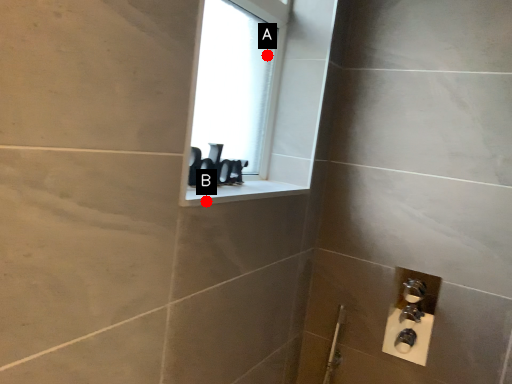
Question: Two points are circled on the image, labeled by A and B beside each circle. Which of the following is the closest to the observer?

Choices:
 (A) A is closer
 (B) B is closer

Answer: (B)